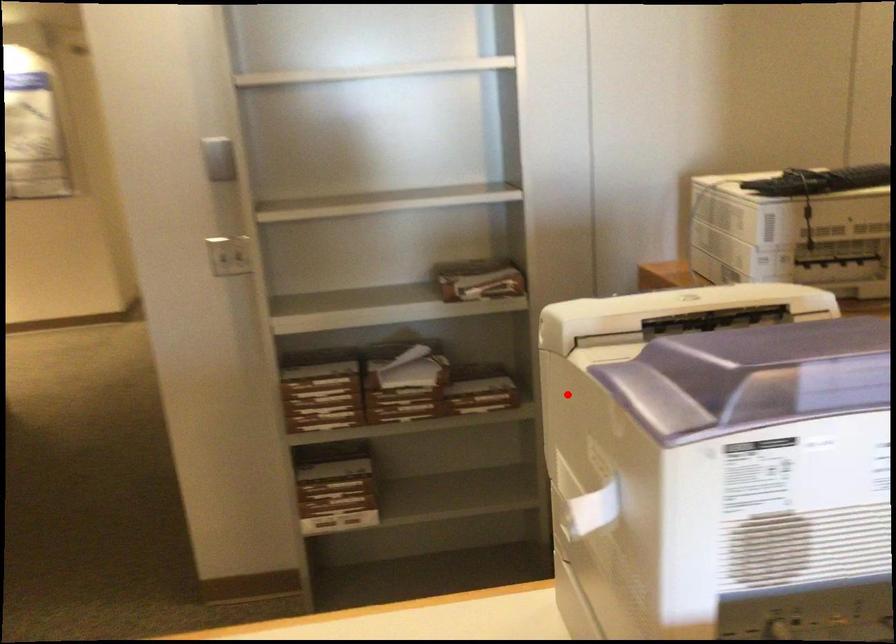
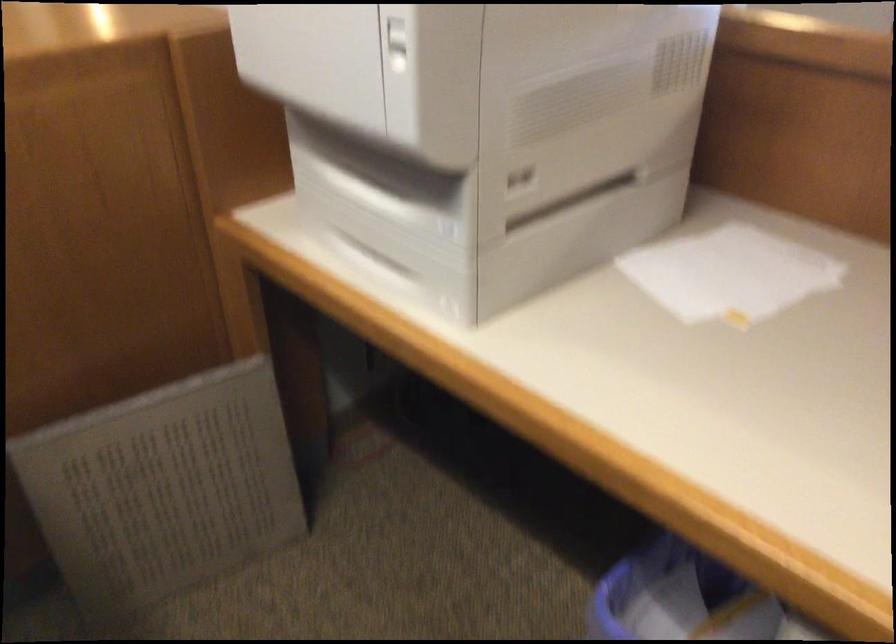
Question: I am providing you with two images of the same scene from different viewpoints. Image1 has a red point marked. In image2, the corresponding 3D location appears at what relative position? Reply with the corresponding letter.

Choices:
 (A) Closer
 (B) Farther

Answer: (A)